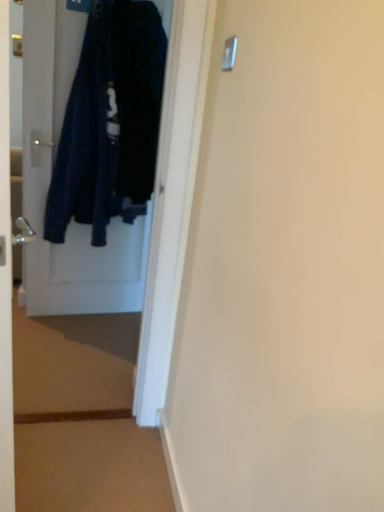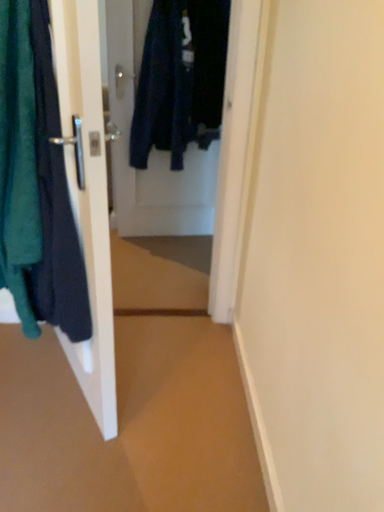
Question: Which way did the camera rotate in the video?

Choices:
 (A) rotated downward
 (B) rotated upward

Answer: (A)